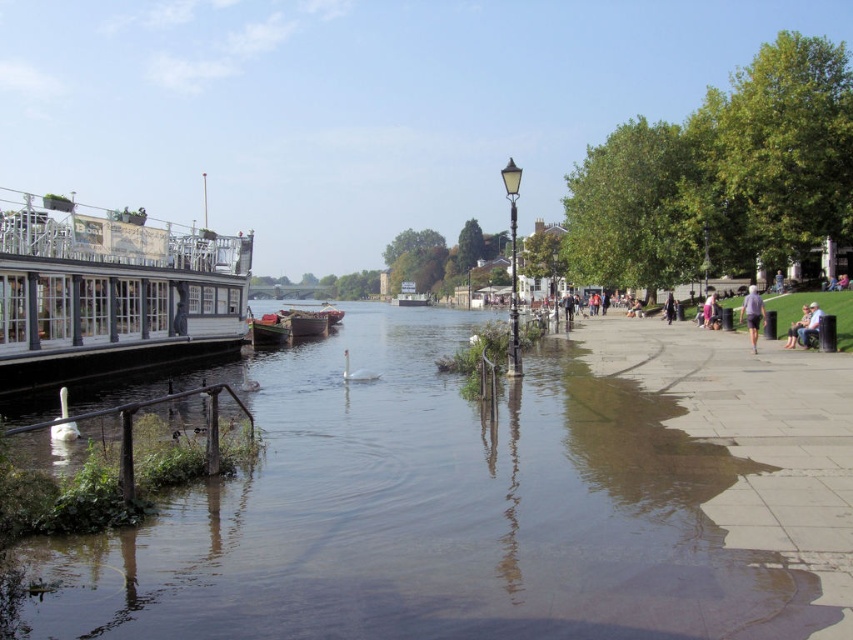
Does clear water at center appear on the right side of light brown wooden bench at lower right?

In fact, clear water at center is to the left of light brown wooden bench at lower right.

Does clear water at center have a smaller size compared to light brown wooden bench at lower right?

Actually, clear water at center might be larger than light brown wooden bench at lower right.

Locate an element on the screen. clear water at center is located at coordinates (439, 515).

Image resolution: width=853 pixels, height=640 pixels. Identify the location of clear water at center. (439, 515).

Is light brown wooden bench at right wider than dark blue jeans at center?

No, light brown wooden bench at right is not wider than dark blue jeans at center.

At what (x,y) coordinates should I click in order to perform the action: click on light brown wooden bench at right. Please return your answer as a coordinate pair (x, y). Looking at the image, I should click on (798, 326).

Can you confirm if sandy concrete pavement at lower right is positioned below white wooden boat at left?

Yes, sandy concrete pavement at lower right is below white wooden boat at left.

Does sandy concrete pavement at lower right have a smaller size compared to white wooden boat at left?

Actually, sandy concrete pavement at lower right might be larger than white wooden boat at left.

Is point (813, 365) positioned in front of point (62, 342)?

Yes, it is.

Locate an element on the screen. The width and height of the screenshot is (853, 640). sandy concrete pavement at lower right is located at coordinates (757, 444).